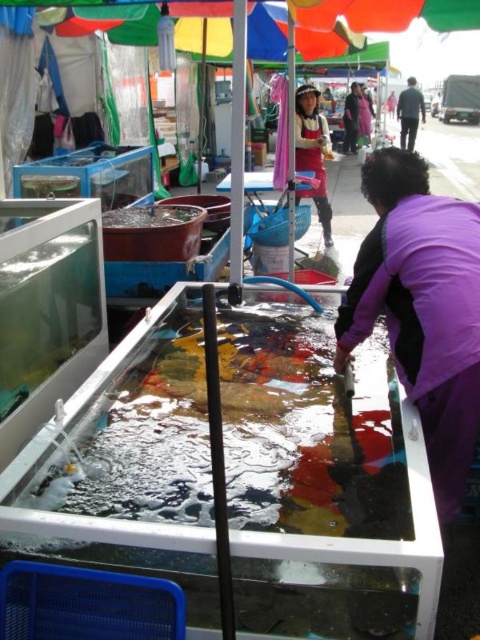
Looking at this image, you are a customer at the fish market and want to buy a fish from the tank. You see the matte purple jacket at center and the dark gray sweater at upper right. Which clothing item is closer to the tank?

The matte purple jacket at center is closer to the tank because it is positioned below the dark gray sweater at upper right, meaning it is lower in the scene and thus nearer to the tank located in the foreground.

You are standing at the fish market and see two points marked in the image. The first point is at coordinate point (x=297, y=131) and the second point is at coordinate point (x=411, y=148). Which point is closer to you?

Point (x=297, y=131) is in front of point (x=411, y=148), so the first point is closer to you.